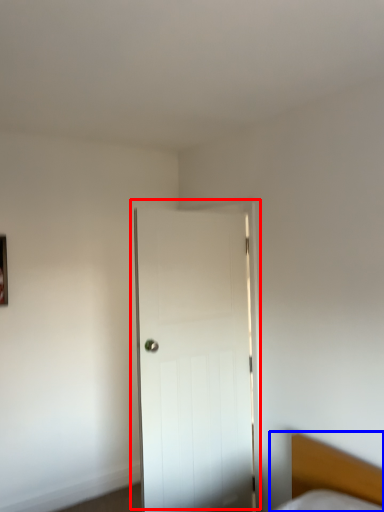
Question: Among these objects, which one is farthest to the camera, door (highlighted by a red box) or bed (highlighted by a blue box)?

Choices:
 (A) door
 (B) bed

Answer: (A)